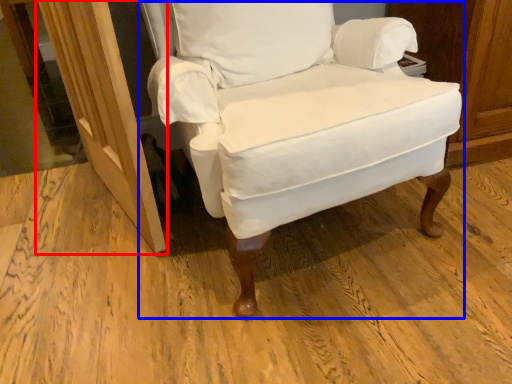
Question: Which object appears farthest to the camera in this image, screen door (highlighted by a red box) or chair (highlighted by a blue box)?

Choices:
 (A) screen door
 (B) chair

Answer: (A)